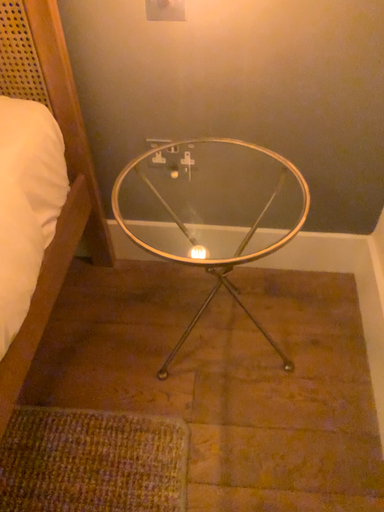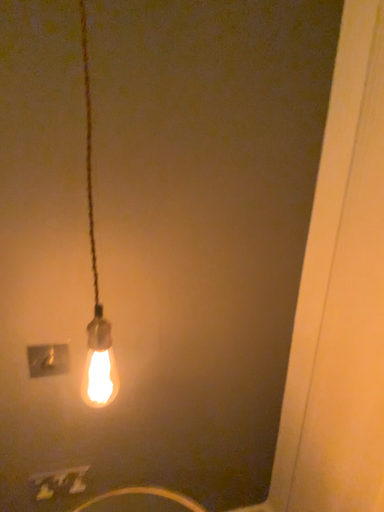
Question: How did the camera likely rotate when shooting the video?

Choices:
 (A) rotated downward
 (B) rotated upward

Answer: (B)